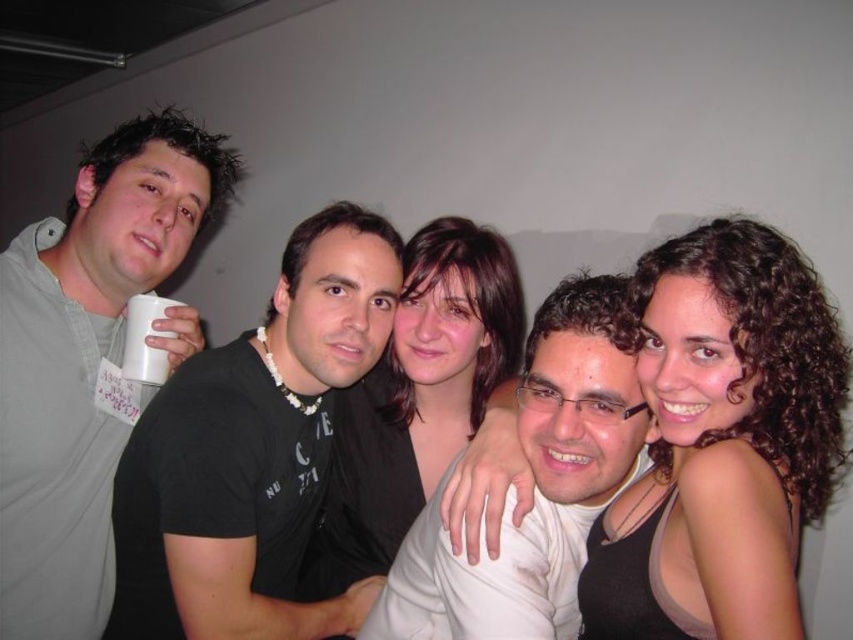
Can you confirm if curly brown hair at center is positioned to the right of white matte cup at upper left?

Correct, you'll find curly brown hair at center to the right of white matte cup at upper left.

Which is more to the left, curly brown hair at center or white matte cup at upper left?

white matte cup at upper left

Which is behind, point (712, 449) or point (148, 384)?

The point (148, 384) is more distant.

The image size is (853, 640). Find the location of `curly brown hair at center`. curly brown hair at center is located at coordinates (735, 420).

Who is positioned more to the left, matte gray shirt at left or white matte shirt at center?

matte gray shirt at left

Consider the image. Is matte gray shirt at left further to the viewer compared to white matte shirt at center?

That is True.

Who is more distant from viewer, (20, 410) or (566, 432)?

The point (20, 410) is behind.

You are a GUI agent. You are given a task and a screenshot of the screen. Output one action in this format:
    pyautogui.click(x=<x>, y=<y>)
    Task: Click on the matte gray shirt at left
    The image size is (853, 640).
    Given the screenshot: What is the action you would take?
    pyautogui.click(x=84, y=360)

Which is more to the right, black matte t-shirt at center or smooth brown hair at center?

smooth brown hair at center

Is black matte t-shirt at center positioned in front of smooth brown hair at center?

Yes, black matte t-shirt at center is in front of smooth brown hair at center.

The height and width of the screenshot is (640, 853). I want to click on black matte t-shirt at center, so click(x=252, y=451).